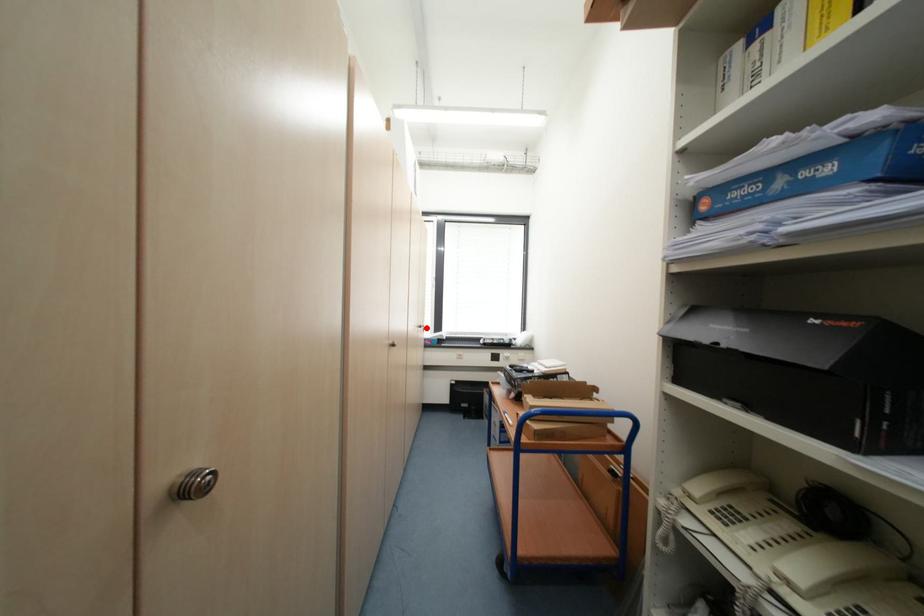
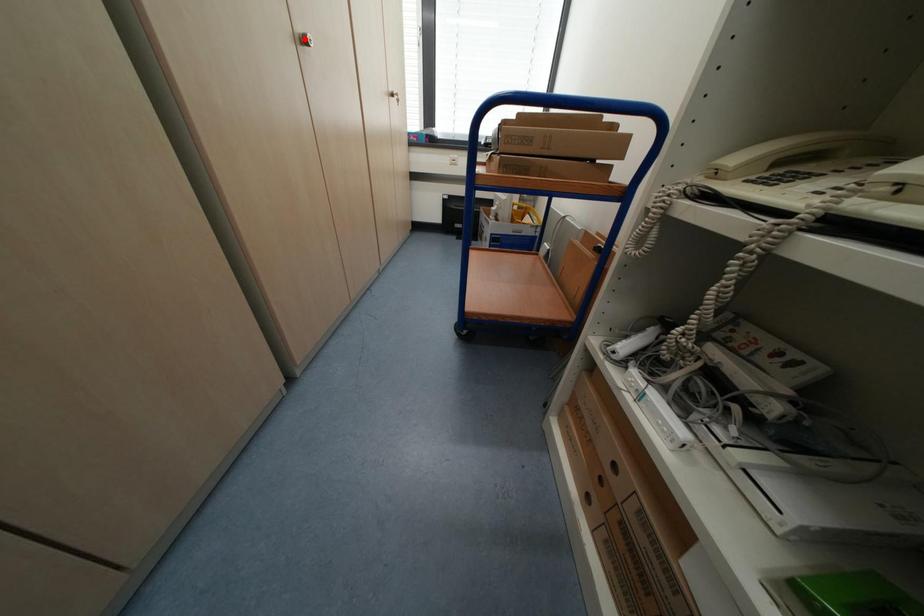
I am providing you with two images of the same scene from different viewpoints. A red point is marked on the first image and another point is marked on the second image. Do the highlighted points in image1 and image2 indicate the same real-world spot?

No